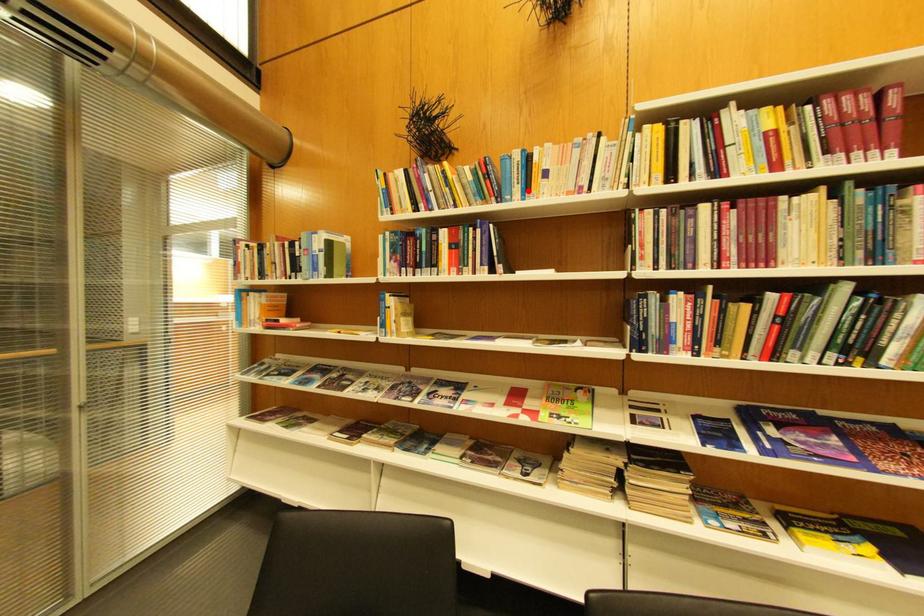
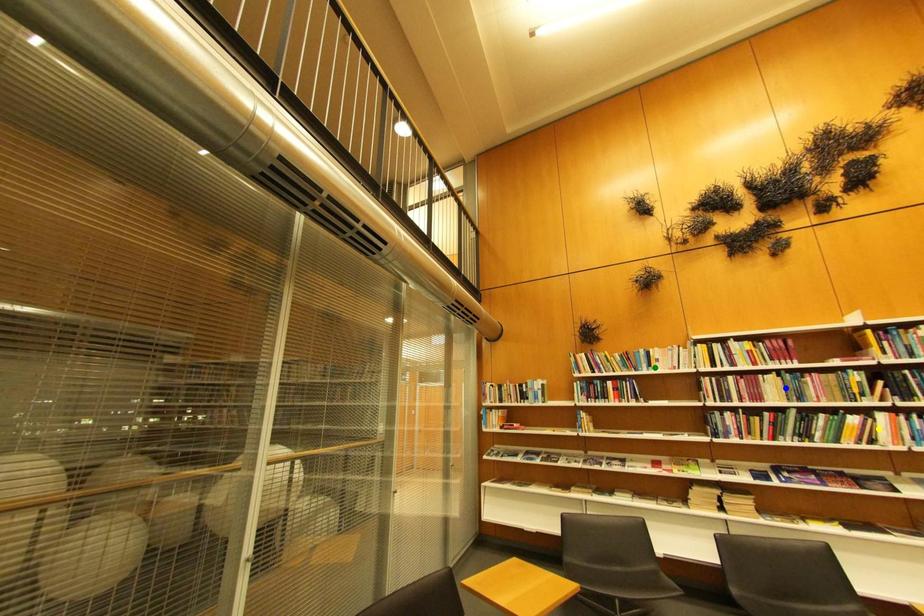
Question: I am providing you with two images of the same scene from different viewpoints. A red point is marked on the first image. You are given multiple points on the second image. Can you choose the point in image 2 that corresponds to the point in image 1?

Choices:
 (A) blue point
 (B) green point
 (C) yellow point

Answer: (B)